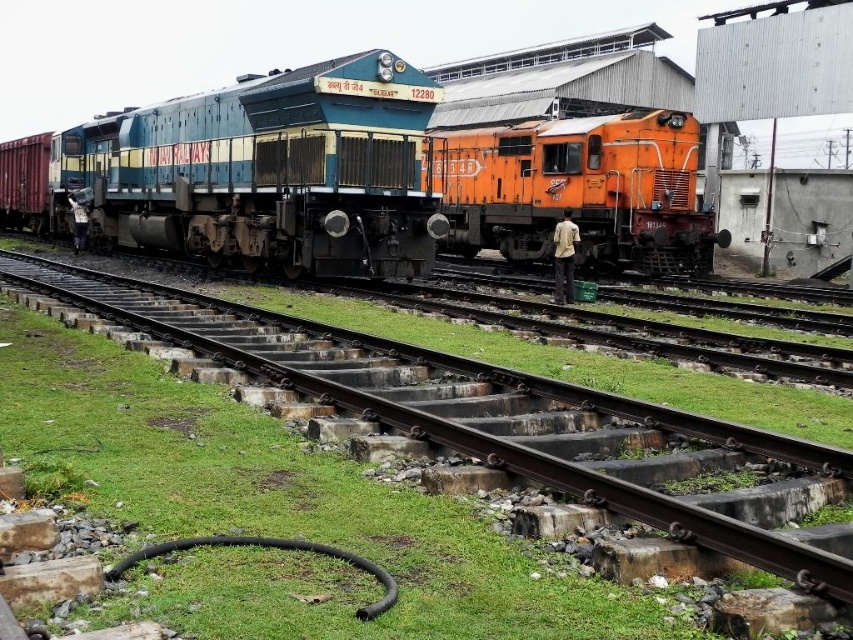
Is orange metallic train at right taller than green grass at lower left?

Yes, orange metallic train at right is taller than green grass at lower left.

Based on the photo, does orange metallic train at right appear under green grass at lower left?

No, orange metallic train at right is not below green grass at lower left.

This screenshot has height=640, width=853. In order to click on orange metallic train at right in this screenshot , I will do `click(577, 189)`.

Is blue metallic locomotive at center smaller than green grass at lower left?

Actually, blue metallic locomotive at center might be larger than green grass at lower left.

Does blue metallic locomotive at center appear on the left side of green grass at lower left?

Correct, you'll find blue metallic locomotive at center to the left of green grass at lower left.

Between point (62, 216) and point (843, 561), which one is positioned behind?

Point (62, 216)

Locate an element on the screen. The width and height of the screenshot is (853, 640). blue metallic locomotive at center is located at coordinates (248, 172).

Consider the image. Who is shorter, blue metallic locomotive at center or orange metallic train at right?

Standing shorter between the two is orange metallic train at right.

Which is below, blue metallic locomotive at center or orange metallic train at right?

orange metallic train at right

At what (x,y) coordinates should I click in order to perform the action: click on blue metallic locomotive at center. Please return your answer as a coordinate pair (x, y). Looking at the image, I should click on (248, 172).